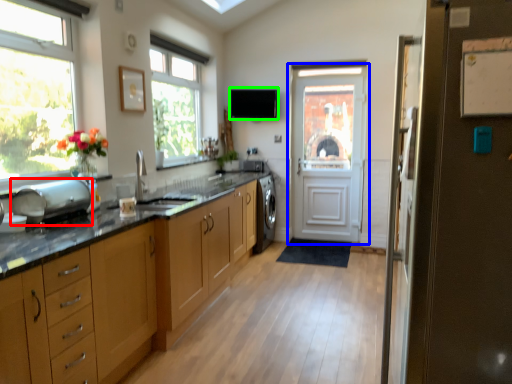
Question: Estimate the real-world distances between objects in this image. Which object is farther from appliance (highlighted by a red box), door (highlighted by a blue box) or exhaust hood (highlighted by a green box)?

Choices:
 (A) door
 (B) exhaust hood

Answer: (A)